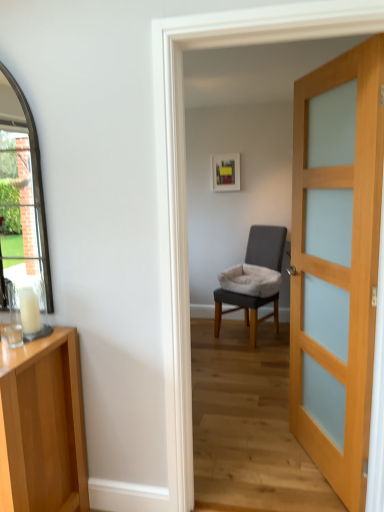
Question: Does wooden door at right have a greater width compared to gray fabric chair at center?

Choices:
 (A) yes
 (B) no

Answer: (B)

Question: Is the position of wooden door at right less distant than that of gray fabric chair at center?

Choices:
 (A) no
 (B) yes

Answer: (B)

Question: From a real-world perspective, does wooden door at right sit lower than gray fabric chair at center?

Choices:
 (A) yes
 (B) no

Answer: (B)

Question: Considering the relative positions of wooden door at right and gray fabric chair at center in the image provided, is wooden door at right to the right of gray fabric chair at center from the viewer's perspective?

Choices:
 (A) yes
 (B) no

Answer: (A)

Question: Considering the relative sizes of wooden door at right and gray fabric chair at center in the image provided, is wooden door at right smaller than gray fabric chair at center?

Choices:
 (A) no
 (B) yes

Answer: (B)

Question: Is wooden door at right far from gray fabric chair at center?

Choices:
 (A) no
 (B) yes

Answer: (B)

Question: Is light wood cabinet at left a part of wooden door at right?

Choices:
 (A) yes
 (B) no

Answer: (B)

Question: Does wooden door at right have a lesser width compared to light wood cabinet at left?

Choices:
 (A) yes
 (B) no

Answer: (A)

Question: From a real-world perspective, is wooden door at right located beneath light wood cabinet at left?

Choices:
 (A) yes
 (B) no

Answer: (B)

Question: From a real-world perspective, is wooden door at right on top of light wood cabinet at left?

Choices:
 (A) yes
 (B) no

Answer: (A)

Question: Is wooden door at right wider than light wood cabinet at left?

Choices:
 (A) no
 (B) yes

Answer: (A)

Question: Does wooden door at right have a smaller size compared to light wood cabinet at left?

Choices:
 (A) no
 (B) yes

Answer: (B)

Question: Considering the relative sizes of gray fabric chair at center and wooden door at right in the image provided, is gray fabric chair at center shorter than wooden door at right?

Choices:
 (A) no
 (B) yes

Answer: (B)